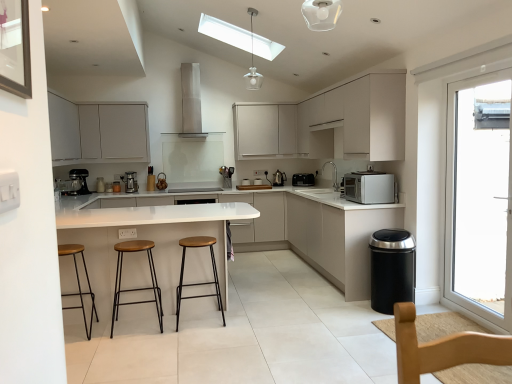
The image size is (512, 384). Find the location of `free area in between wooden seat stool at center, the first stool when ordered from right to left, and black matte trash can at lower right`. free area in between wooden seat stool at center, the first stool when ordered from right to left, and black matte trash can at lower right is located at coordinates (289, 314).